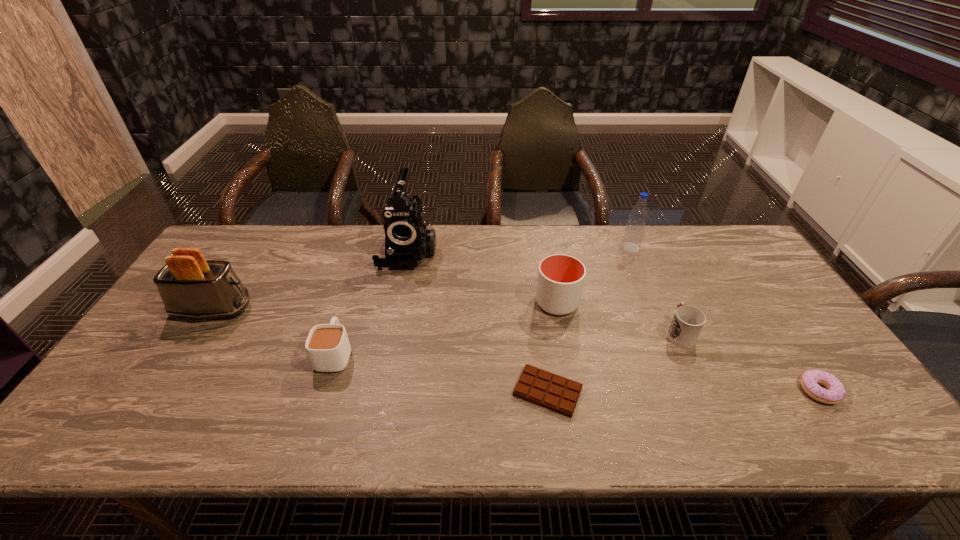
At what (x,y) coordinates should I click in order to perform the action: click on the tallest object. Please return your answer as a coordinate pair (x, y). This screenshot has height=540, width=960. Looking at the image, I should click on (407, 242).

Locate an element on the screen. The width and height of the screenshot is (960, 540). water bottle is located at coordinates (634, 231).

This screenshot has height=540, width=960. Find the location of `the leftmost object`. the leftmost object is located at coordinates (190, 286).

Locate an element on the screen. This screenshot has height=540, width=960. the tallest cup is located at coordinates (560, 281).

Identify the location of the fifth shortest object. (560, 281).

This screenshot has height=540, width=960. Identify the location of the leftmost cup. (327, 345).

Where is `the rightmost cup`? The width and height of the screenshot is (960, 540). the rightmost cup is located at coordinates (688, 321).

Where is `doughnut`? The width and height of the screenshot is (960, 540). doughnut is located at coordinates (835, 392).

At what (x,y) coordinates should I click in order to perform the action: click on the rightmost object. Please return your answer as a coordinate pair (x, y). Looking at the image, I should click on (835, 392).

You are a GUI agent. You are given a task and a screenshot of the screen. Output one action in this format:
    pyautogui.click(x=<x>, y=<y>)
    Task: Click on the candy bar
    The height and width of the screenshot is (540, 960).
    Given the screenshot: What is the action you would take?
    pyautogui.click(x=556, y=393)